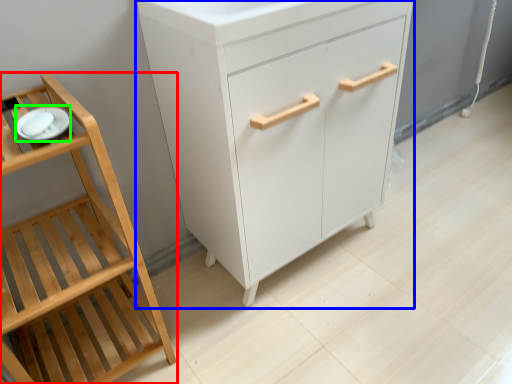
Question: Estimate the real-world distances between objects in this image. Which object is closer to furniture (highlighted by a red box), chest of drawers (highlighted by a blue box) or tableware (highlighted by a green box)?

Choices:
 (A) chest of drawers
 (B) tableware

Answer: (B)